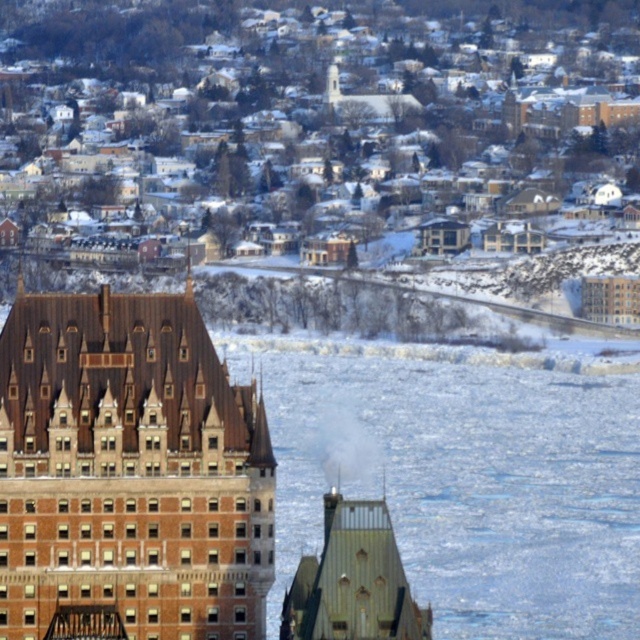
You are standing at the center of the image. Which direction should you move to get closer to the brown brick building at left?

Since the brown brick building at left is located at point [129,470], you should move to the left to get closer to it.

You are a delivery drone with a maximum flight range of 40 feet. You need to deliver a package to the green metallic tower at center from the brown brick building at left. Can you make the delivery without needing to recharge?

The distance between the brown brick building at left and the green metallic tower at center is 38.13 feet, which is within your 40 feet flight range. Yes, you can make the delivery without needing to recharge.